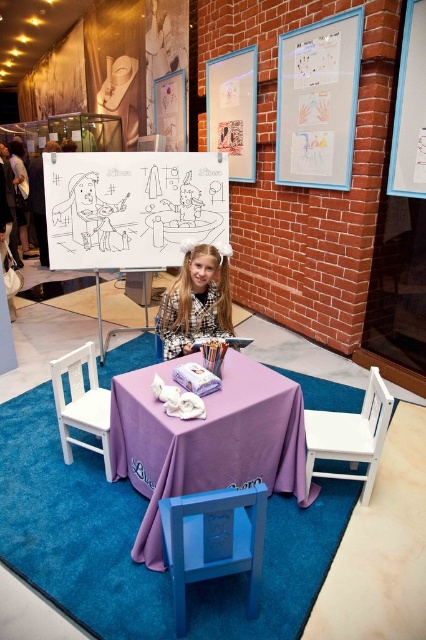
You are standing in the art gallery and want to take a photo of the two points mentioned. Which point, point (x=293, y=468) or point (x=63, y=406), will appear larger in your photo?

Point (x=293, y=468) is closer to the camera than point (x=63, y=406), so it will appear larger in the photo.

You are a visitor in the art gallery and want to sit down to rest. There are two chairs available, the smooth blue chair at lower center and the white wood chair at lower right. Which chair is on the left side when facing the table?

The smooth blue chair at lower center is positioned on the left side of the white wood chair at lower right, so when facing the table, the smooth blue chair at lower center is on the left.

You need to place a rectangular box that is the size of the white wood chair at lower right onto the purple fabric tablecloth at center. Will it fit?

The purple fabric tablecloth at center is bigger than the white wood chair at lower right, so the box will fit on the tablecloth.